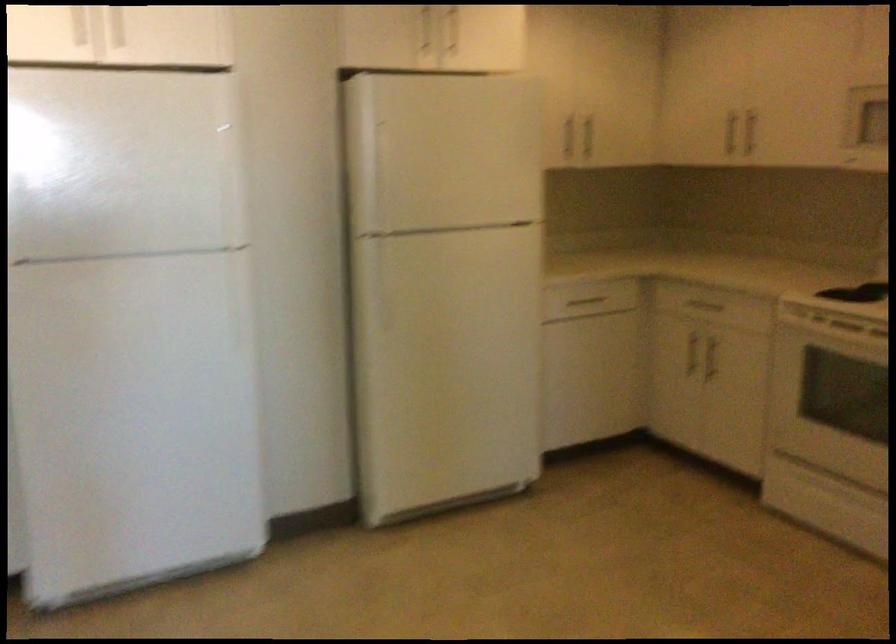
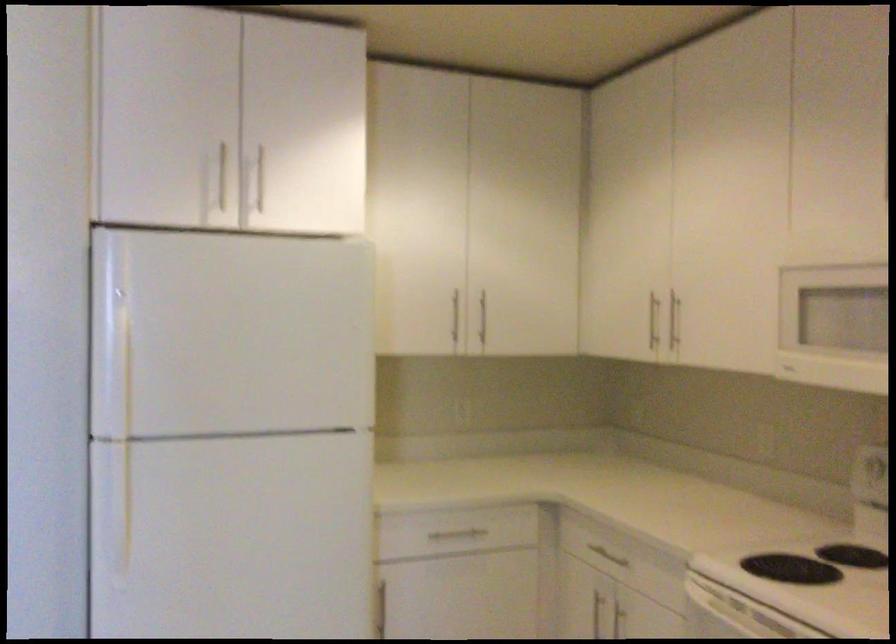
Where in the second image is the point corresponding to the point at 565,136 from the first image?

(454, 317)